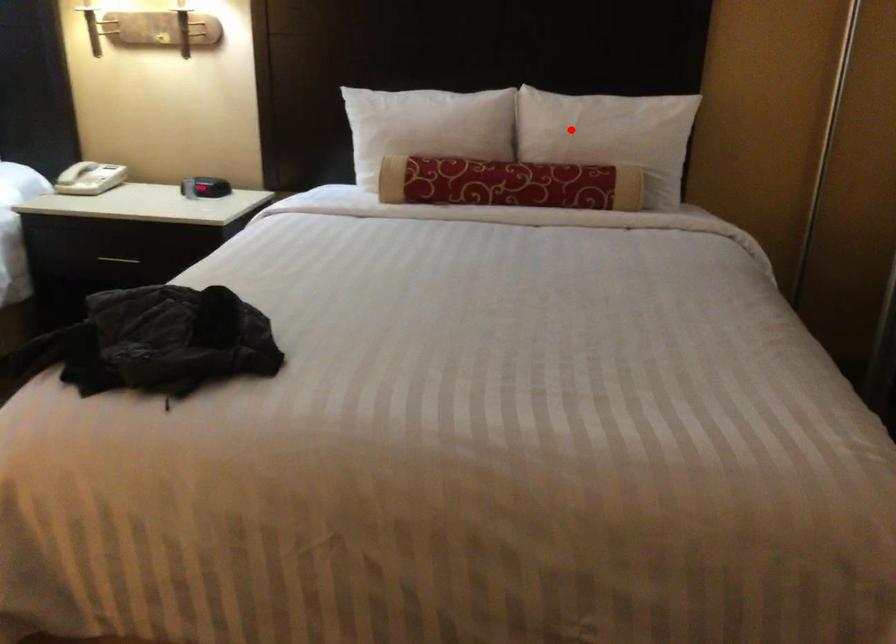
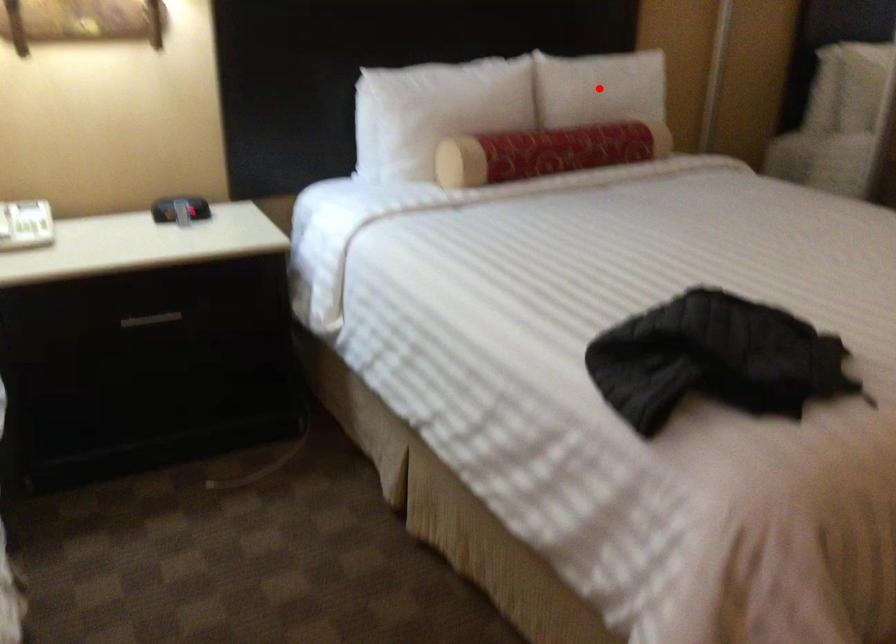
I am providing you with two images of the same scene from different viewpoints. A red point is marked on the first image and another point is marked on the second image. Are the points marked in image1 and image2 representing the same 3D position?

Yes